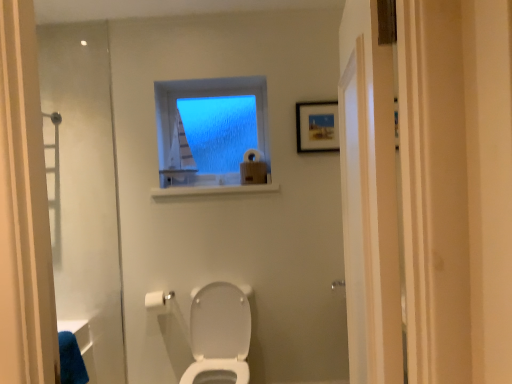
This screenshot has height=384, width=512. What do you see at coordinates (160, 302) in the screenshot?
I see `white matte toilet paper at lower center, acting as the 2th toilet paper starting from the right` at bounding box center [160, 302].

You are a GUI agent. You are given a task and a screenshot of the screen. Output one action in this format:
    pyautogui.click(x=<x>, y=<y>)
    Task: Click on the white matte toilet paper at lower center, the 2th toilet paper viewed from the back
    
    Given the screenshot: What is the action you would take?
    pyautogui.click(x=160, y=302)

The height and width of the screenshot is (384, 512). Describe the element at coordinates (219, 334) in the screenshot. I see `white glossy toilet at center` at that location.

You are a GUI agent. You are given a task and a screenshot of the screen. Output one action in this format:
    pyautogui.click(x=<x>, y=<y>)
    Task: Click on the wooden framed picture at upper right
    
    Given the screenshot: What is the action you would take?
    pyautogui.click(x=317, y=126)

The height and width of the screenshot is (384, 512). Describe the element at coordinates (212, 135) in the screenshot. I see `blue frosted glass window at upper center` at that location.

What are the coordinates of `blue frosted glass window at upper center` in the screenshot? It's located at (212, 135).

You are a GUI agent. You are given a task and a screenshot of the screen. Output one action in this format:
    pyautogui.click(x=<x>, y=<y>)
    Task: Click on the white matte toilet paper at lower center, which is the 1th toilet paper in left-to-right order
    
    Given the screenshot: What is the action you would take?
    pyautogui.click(x=160, y=302)

Does wooden framed picture at upper right have a lesser width compared to white glossy toilet at center?

Yes, wooden framed picture at upper right is thinner than white glossy toilet at center.

Is wooden framed picture at upper right at the left side of white glossy toilet at center?

Incorrect, wooden framed picture at upper right is not on the left side of white glossy toilet at center.

Is point (325, 135) closer or farther from the camera than point (234, 294)?

Point (325, 135).

Considering the sizes of wooden framed picture at upper right and white glossy toilet at center in the image, is wooden framed picture at upper right taller or shorter than white glossy toilet at center?

In the image, wooden framed picture at upper right appears to be shorter than white glossy toilet at center.

Is white glossy toilet at center completely or partially outside of white matte toilet paper at lower center, which is the 1th toilet paper in left-to-right order?

Yes, white glossy toilet at center is located beyond the bounds of white matte toilet paper at lower center, which is the 1th toilet paper in left-to-right order.

From the picture: How many degrees apart are the facing directions of white glossy toilet at center and white matte toilet paper at lower center, which is the 1th toilet paper in left-to-right order?

The facing directions of white glossy toilet at center and white matte toilet paper at lower center, which is the 1th toilet paper in left-to-right order, are 1.62 degrees apart.

Is white glossy toilet at center oriented towards white matte toilet paper at lower center, which is the 1th toilet paper in left-to-right order?

No, white glossy toilet at center does not turn towards white matte toilet paper at lower center, which is the 1th toilet paper in left-to-right order.

From the image's perspective, between white glossy toilet at center and white matte toilet paper at lower center, the 2th toilet paper viewed from the back, which one is located above?

white matte toilet paper at lower center, the 2th toilet paper viewed from the back, is shown above in the image.

Can you tell me how much blue frosted glass window at upper center and white matte toilet paper at upper center, the second toilet paper when ordered from front to back, differ in facing direction?

They differ by 14.2 degrees in their facing directions.

Find the location of a particular element. This screenshot has width=512, height=384. window lying above the white matte toilet paper at upper center, the second toilet paper when ordered from front to back (from the image's perspective) is located at coordinates (212, 135).

From a real-world perspective, is blue frosted glass window at upper center physically located above or below white matte toilet paper at upper center, the 1th toilet paper positioned from the back?

blue frosted glass window at upper center is situated higher than white matte toilet paper at upper center, the 1th toilet paper positioned from the back, in the real world.

Is blue frosted glass window at upper center surrounding white matte toilet paper at upper center, the second toilet paper when ordered from front to back?

No, blue frosted glass window at upper center does not contain white matte toilet paper at upper center, the second toilet paper when ordered from front to back.

Does white glossy toilet at center turn towards blue frosted glass window at upper center?

No, white glossy toilet at center is not facing towards blue frosted glass window at upper center.

Is blue frosted glass window at upper center surrounded by white glossy toilet at center?

Actually, blue frosted glass window at upper center is outside white glossy toilet at center.

Between white glossy toilet at center and blue frosted glass window at upper center, which one has more height?

white glossy toilet at center is taller.

From the image's perspective, is white glossy toilet at center above or below blue frosted glass window at upper center?

white glossy toilet at center is below blue frosted glass window at upper center.

Based on the photo, in the image, is white glossy toilet at center positioned in front of or behind white matte toilet paper at upper center, the second toilet paper when ordered from front to back?

In the image, white glossy toilet at center appears in front of white matte toilet paper at upper center, the second toilet paper when ordered from front to back.

From a real-world perspective, is white glossy toilet at center located higher than white matte toilet paper at upper center, the 2th toilet paper positioned from the left?

No.

Identify the location of the 2nd toilet paper behind the white glossy toilet at center, counting from the anchor's position. The width and height of the screenshot is (512, 384). (252, 155).

Can you see white matte toilet paper at lower center, the second toilet paper from the top, touching blue frosted glass window at upper center?

No, white matte toilet paper at lower center, the second toilet paper from the top, is not next to blue frosted glass window at upper center.

Between white matte toilet paper at lower center, the 2th toilet paper viewed from the back, and blue frosted glass window at upper center, which one has larger width?

With larger width is white matte toilet paper at lower center, the 2th toilet paper viewed from the back.

Measure the distance between white matte toilet paper at lower center, which ranks as the 1th toilet paper in front-to-back order, and blue frosted glass window at upper center.

A distance of 1.00 meters exists between white matte toilet paper at lower center, which ranks as the 1th toilet paper in front-to-back order, and blue frosted glass window at upper center.

From a real-world perspective, is white matte toilet paper at lower center, which is the 1th toilet paper in left-to-right order, positioned over blue frosted glass window at upper center based on gravity?

No.

Between blue frosted glass window at upper center and white matte toilet paper at lower center, the 2th toilet paper viewed from the back, which one is positioned in front?

white matte toilet paper at lower center, the 2th toilet paper viewed from the back, is more forward.

I want to click on the 2nd toilet paper below the blue frosted glass window at upper center (from the image's perspective), so click(x=160, y=302).

Considering the sizes of objects blue frosted glass window at upper center and white matte toilet paper at lower center, the first toilet paper ordered from the bottom, in the image provided, who is shorter, blue frosted glass window at upper center or white matte toilet paper at lower center, the first toilet paper ordered from the bottom,?

Standing shorter between the two is white matte toilet paper at lower center, the first toilet paper ordered from the bottom.

Where is `picture frame that is above the white glossy toilet at center (from a real-world perspective)`? picture frame that is above the white glossy toilet at center (from a real-world perspective) is located at coordinates (317, 126).

Locate an element on the screen. This screenshot has width=512, height=384. toilet paper that appears on the left of white glossy toilet at center is located at coordinates (160, 302).

When comparing their distances from white matte toilet paper at upper center, placed as the second toilet paper when sorted from bottom to top, does white glossy toilet at center or wooden framed picture at upper right seem closer?

Based on the image, wooden framed picture at upper right appears to be nearer to white matte toilet paper at upper center, placed as the second toilet paper when sorted from bottom to top.

Estimate the real-world distances between objects in this image. Which object is further from white glossy toilet at center, white matte toilet paper at upper center, the second toilet paper when ordered from front to back, or white matte toilet paper at lower center, the 2th toilet paper viewed from the back?

white matte toilet paper at upper center, the second toilet paper when ordered from front to back.

From the image, which object appears to be nearer to wooden framed picture at upper right, white matte toilet paper at lower center, the 2th toilet paper viewed from the back, or white matte toilet paper at upper center, placed as the second toilet paper when sorted from bottom to top?

Based on the image, white matte toilet paper at upper center, placed as the second toilet paper when sorted from bottom to top, appears to be nearer to wooden framed picture at upper right.

Based on their spatial positions, is white matte toilet paper at lower center, the second toilet paper from the top, or blue frosted glass window at upper center further from white matte toilet paper at upper center, the 2th toilet paper positioned from the left?

white matte toilet paper at lower center, the second toilet paper from the top, is further to white matte toilet paper at upper center, the 2th toilet paper positioned from the left.

Considering their positions, is white glossy toilet at center positioned closer to white matte toilet paper at upper center, the second toilet paper when ordered from front to back, than blue frosted glass window at upper center?

The object closer to white matte toilet paper at upper center, the second toilet paper when ordered from front to back, is blue frosted glass window at upper center.

From the image, which object appears to be farther from white matte toilet paper at lower center, the 2th toilet paper viewed from the back, white matte toilet paper at upper center, the 2th toilet paper positioned from the left, or wooden framed picture at upper right?

wooden framed picture at upper right lies further to white matte toilet paper at lower center, the 2th toilet paper viewed from the back, than the other object.

From the image, which object appears to be nearer to white matte toilet paper at lower center, the 2th toilet paper viewed from the back, wooden framed picture at upper right or blue frosted glass window at upper center?

blue frosted glass window at upper center is positioned closer to the anchor white matte toilet paper at lower center, the 2th toilet paper viewed from the back.

When comparing their distances from white glossy toilet at center, does white matte toilet paper at upper center, the 2th toilet paper positioned from the left, or wooden framed picture at upper right seem closer?

Based on the image, white matte toilet paper at upper center, the 2th toilet paper positioned from the left, appears to be nearer to white glossy toilet at center.

Find the location of a particular element. This screenshot has width=512, height=384. toilet paper that lies between wooden framed picture at upper right and white matte toilet paper at lower center, which ranks as the 1th toilet paper in front-to-back order, from top to bottom is located at coordinates (252, 155).

Find the location of a particular element. window between wooden framed picture at upper right and white matte toilet paper at lower center, which is the 1th toilet paper in left-to-right order, vertically is located at coordinates (212, 135).

This screenshot has height=384, width=512. I want to click on toilet paper between blue frosted glass window at upper center and white matte toilet paper at lower center, acting as the 2th toilet paper starting from the right, from top to bottom, so click(x=252, y=155).

Locate an element on the screen. window between wooden framed picture at upper right and white glossy toilet at center vertically is located at coordinates (212, 135).